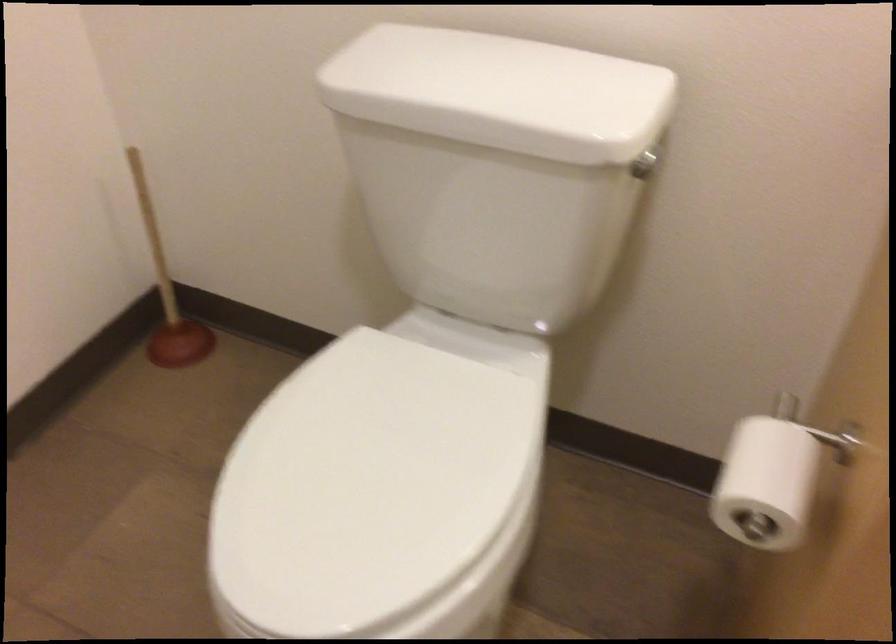
Identify the location of white toilet lid. This screenshot has height=644, width=896. (376, 496).